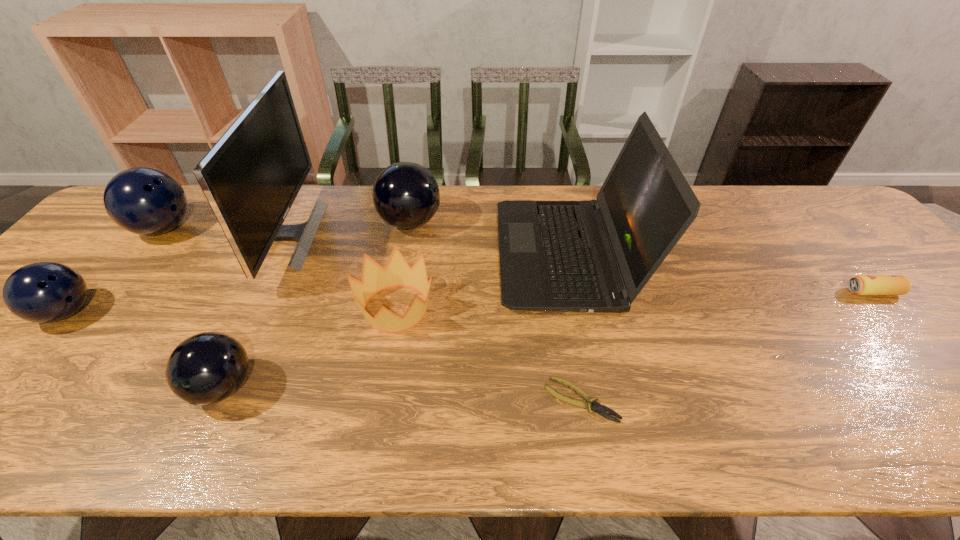
Identify the location of vacant region located 0.210m on the surface of the farther blue bowling ball near the finger holes. The image size is (960, 540). (267, 228).

Where is `vacant space located 0.200m on the side of the bigger black bowling ball with the finger holes`? This screenshot has height=540, width=960. vacant space located 0.200m on the side of the bigger black bowling ball with the finger holes is located at coordinates (508, 222).

The height and width of the screenshot is (540, 960). I want to click on free point located 0.180m on the surface of the second nearest bowling ball near the finger holes, so click(169, 312).

Locate an element on the screen. This screenshot has width=960, height=540. vacant area situated on the side of the nearer black bowling ball with the finger holes is located at coordinates (192, 453).

Identify the location of free space located on the front of the gold crown. The image size is (960, 540). (374, 431).

Locate an element on the screen. This screenshot has width=960, height=540. free space located 0.170m on the back of the third shortest object is located at coordinates (830, 242).

This screenshot has height=540, width=960. What are the coordinates of `free point located on the back of the pliers` in the screenshot? It's located at (564, 302).

Identify the location of monitor that is at the far edge. (252, 175).

Identify the location of laptop_computer at the far edge. This screenshot has width=960, height=540. (593, 255).

Where is `bowling ball at the near edge`? Image resolution: width=960 pixels, height=540 pixels. bowling ball at the near edge is located at coordinates (206, 368).